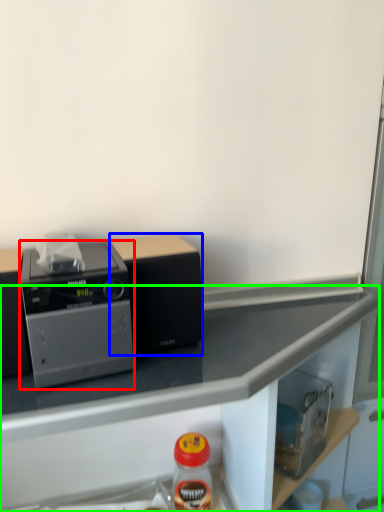
Question: Which is farther away from home appliance (highlighted by a red box)? appliance (highlighted by a blue box) or countertop (highlighted by a green box)?

Choices:
 (A) appliance
 (B) countertop

Answer: (B)